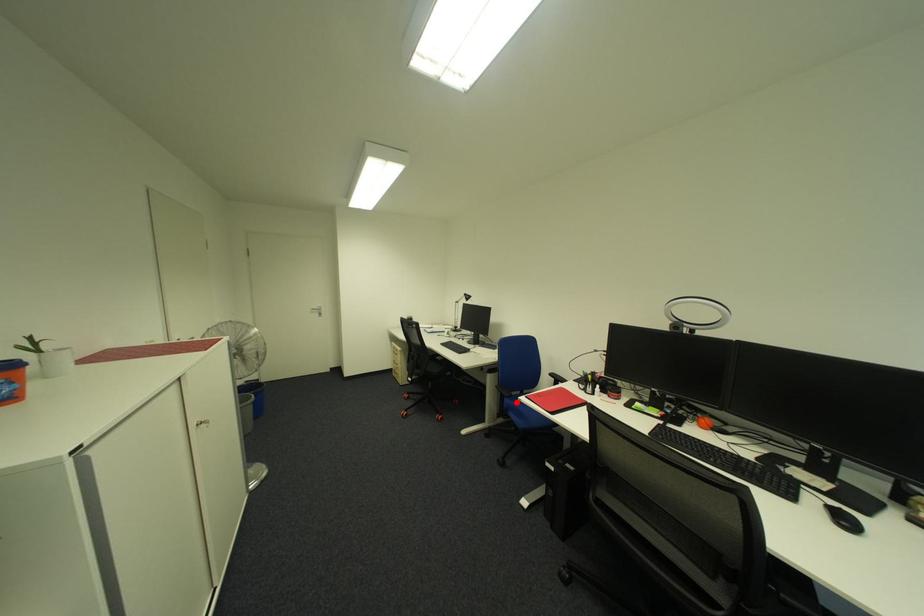
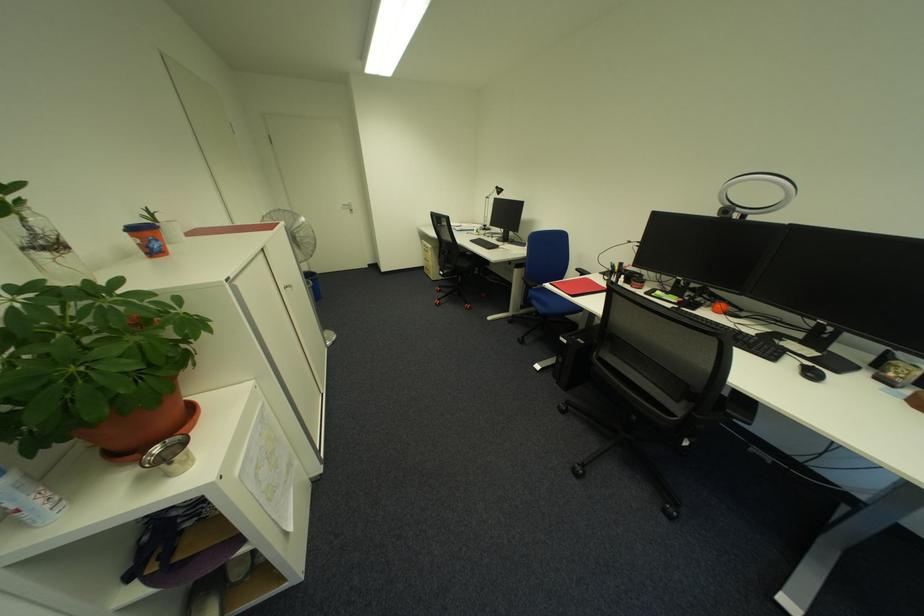
The point at the highlighted location is marked in the first image. Where is the corresponding point in the second image?

(541, 293)